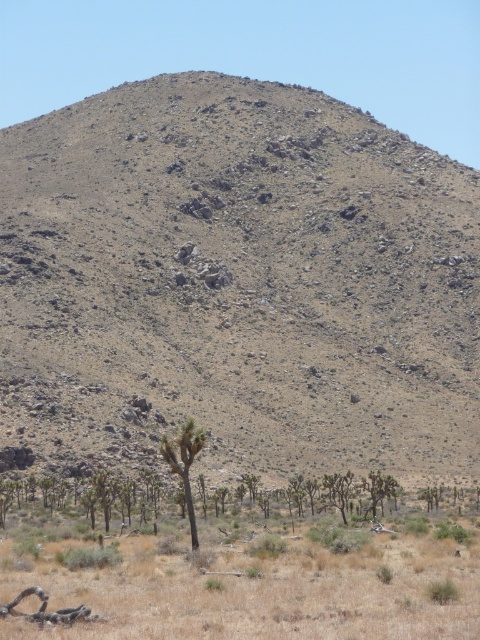
You are a hiker who wants to cross the desert from the dry grass at lower center to the dull brown rocky hillside at center. Given that your water supply can only last for a 300 feet hike, is it safe to proceed?

The distance between the dry grass at lower center and the dull brown rocky hillside at center is 349.33 feet, which exceeds your water supply limit of 300 feet. It is not safe to proceed with the current water supply.

You are a hiker trying to navigate through the desert. You see the dull brown rocky hillside at center and the dry grass at lower center. Which terrain would be harder to walk on?

The dull brown rocky hillside at center is positioned over dry grass at lower center, so the rocky hillside would be harder to walk on due to its uneven and rocky terrain compared to the flat dry grass.

You are a hiker trying to reach the base of the dull brown rocky hillside at center. You see the green leafy tree at lower center in your path. Which object is closer to you, and will you encounter the tree before reaching the hillside?

The green leafy tree at lower center is closer to you than the dull brown rocky hillside at center. Therefore, you will encounter the green leafy tree at lower center before reaching the dull brown rocky hillside at center.